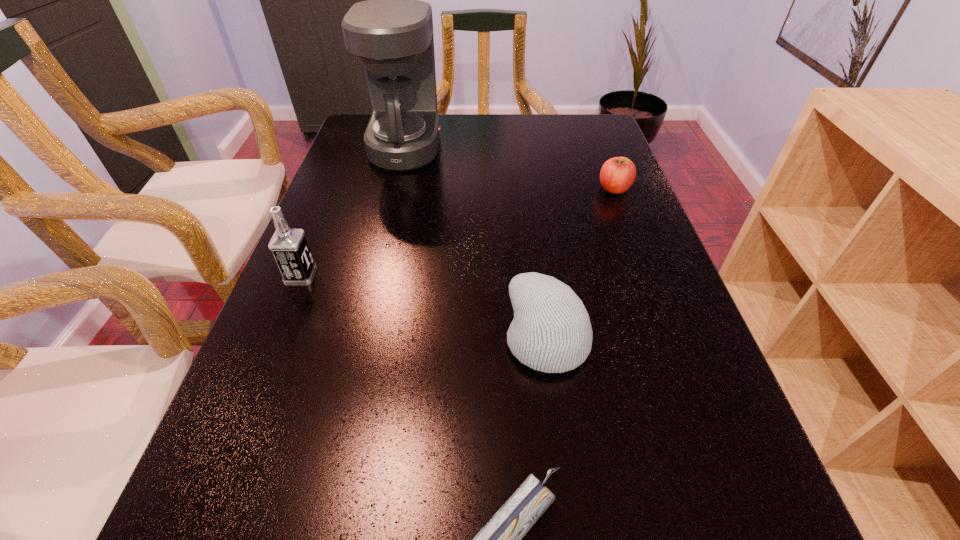
Locate an element on the screen. The width and height of the screenshot is (960, 540). the tallest object is located at coordinates (392, 32).

You are a GUI agent. You are given a task and a screenshot of the screen. Output one action in this format:
    pyautogui.click(x=<x>, y=<y>)
    Task: Click on the coffee maker
    The width and height of the screenshot is (960, 540).
    Given the screenshot: What is the action you would take?
    pyautogui.click(x=392, y=32)

I want to click on the third farthest object, so click(x=289, y=247).

You are a GUI agent. You are given a task and a screenshot of the screen. Output one action in this format:
    pyautogui.click(x=<x>, y=<y>)
    Task: Click on the leftmost object
    This screenshot has height=540, width=960.
    Given the screenshot: What is the action you would take?
    coord(289,247)

Find the location of a particular element. the fourth farthest object is located at coordinates (551, 332).

Identify the location of beanie. This screenshot has height=540, width=960. (551, 332).

Locate an element on the screen. The image size is (960, 540). the rightmost object is located at coordinates (617, 174).

I want to click on the second shortest object, so click(617, 174).

Locate an element on the screen. free spot located on the button side of the second object from left to right is located at coordinates (504, 148).

This screenshot has width=960, height=540. I want to click on free location located 0.240m on the front label of the third nearest object, so click(428, 276).